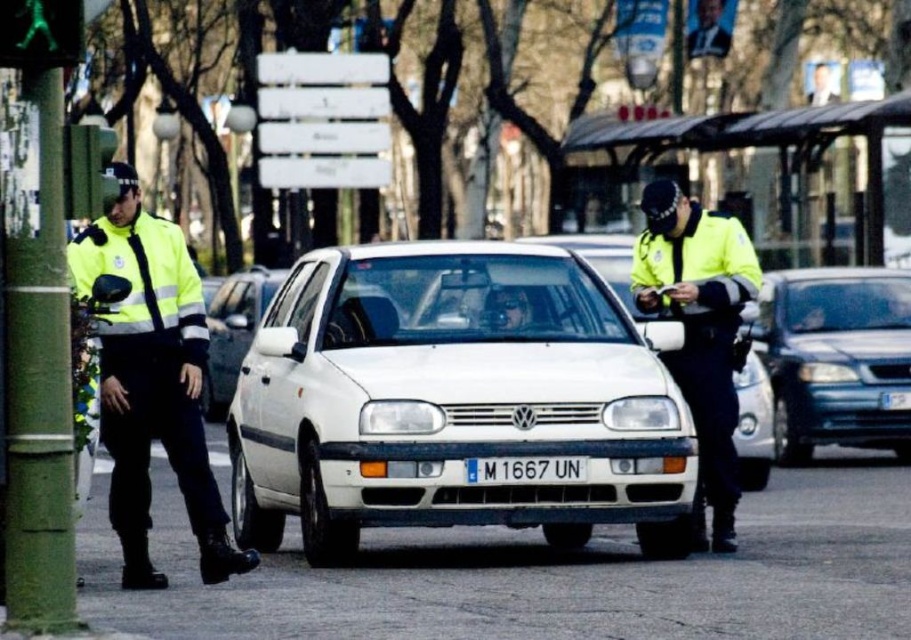
You are a pedestrian standing on the sidewalk observing the scene. You notice the high visibility yellow jacket at left and the white plastic license plate at center. Which object is wider?

The high visibility yellow jacket at left is wider than the white plastic license plate at center.

Looking at this image, you are standing at the viewpoint of the image and see two points labeled as point (484, 346) and point (737, 248). Which point is closer to you?

Point (484, 346) is in front of point (737, 248), so it is closer to you.

You are a pedestrian standing on the sidewalk observing the scene. Which object is positioned lower in the image, the white matte hatchback at center or the high visibility yellow jacket at center?

The white matte hatchback at center is located below the high visibility yellow jacket at center, so it is positioned lower in the image.